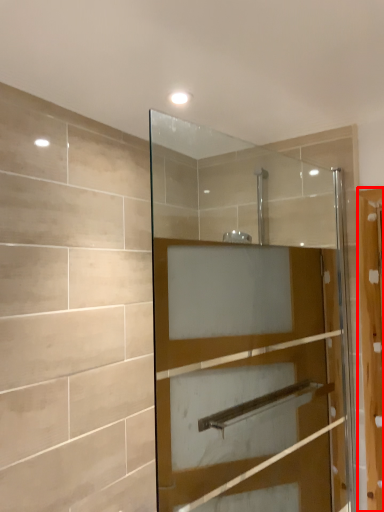
Question: From the image's perspective, considering the relative positions of screen door (annotated by the red box) and door in the image provided, where is screen door (annotated by the red box) located with respect to the staircase?

Choices:
 (A) below
 (B) above

Answer: (A)